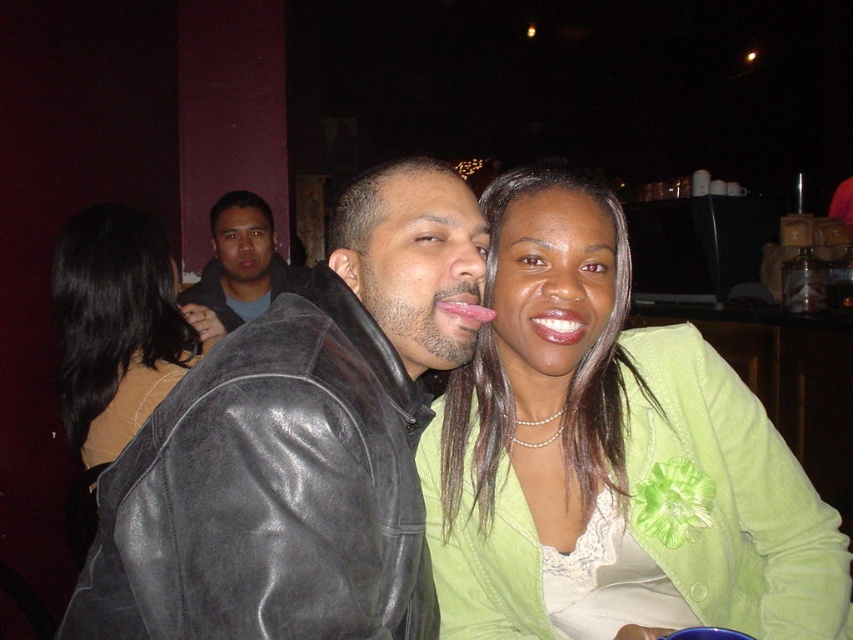
You are a photographer trying to capture a closeup shot of the black leather jacket at center. According to the coordinates provided, where should you aim your camera to ensure the jacket is centered in the frame?

The black leather jacket at center is located at coordinates point (x=299, y=444), so aim your camera there to center it in the frame.